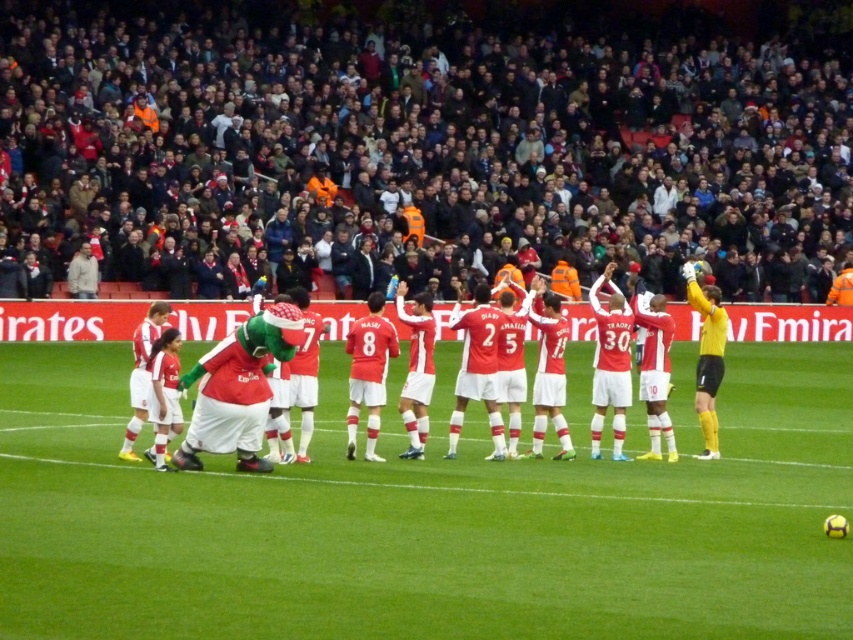
Looking at this image, you are a photographer trying to capture a wide shot of the dark gray concrete stadium at upper center and the green grass football field at center. Given the size difference between them, which object should you focus on to ensure both are clearly visible in the frame?

The dark gray concrete stadium at upper center is larger in size than the green grass football field at center, so you should focus on the stadium to ensure both are clearly visible in the frame.

You are a drone operator trying to capture the stadium from above. The dark gray concrete stadium at upper center is located at point (418, 148). Can you confirm the coordinates of the dark gray concrete stadium at upper center?

The dark gray concrete stadium at upper center is located at point (418, 148).

You are standing at the point labeled as point [755,483] in the Emirates Stadium soccer match image. A ball is kicked from your position towards the direction of the advertising boards in the background. If the ball travels straight for 15 meters, will it go beyond the stadium field? Please explain your reasoning.

The distance between point [755,483] and the viewer is 14.32 meters. If the ball travels straight for 15 meters from your position towards the advertising boards, it will go beyond the stadium field since 15 meters exceeds the 14.32 meters distance to the boards, which are at the edge of the field.